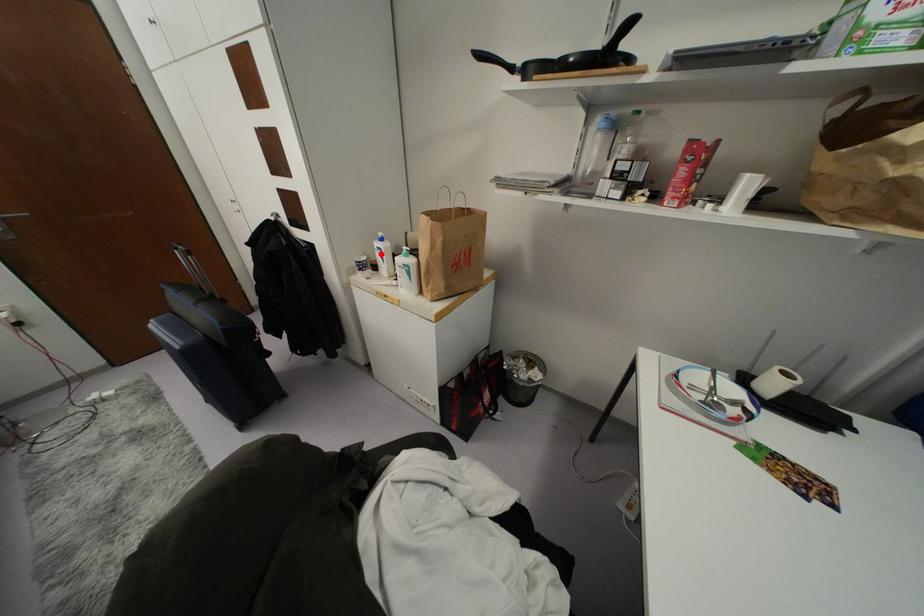
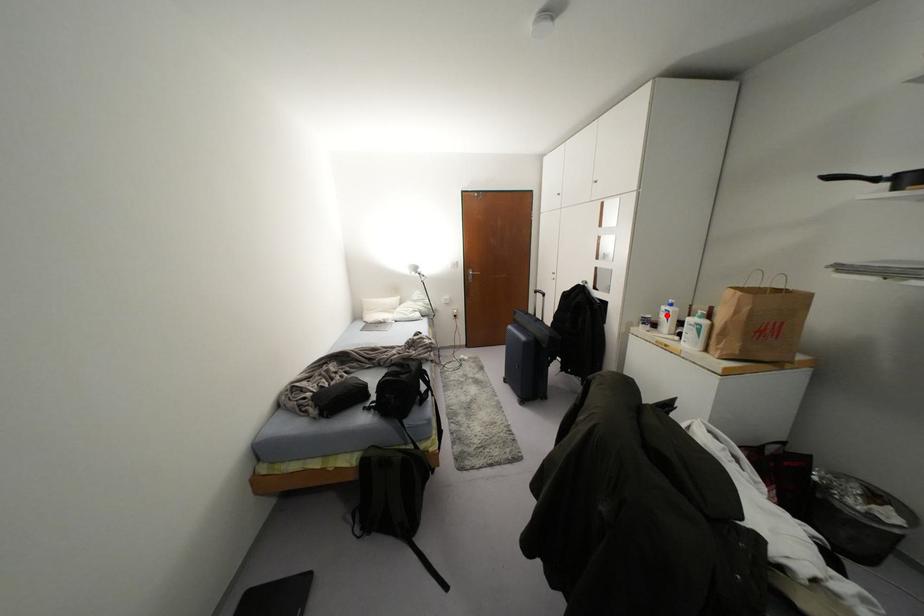
I am providing you with two images of the same scene from different viewpoints. A red point is marked on the first image and another point is marked on the second image. Are the points marked in image1 and image2 representing the same 3D position?

Yes